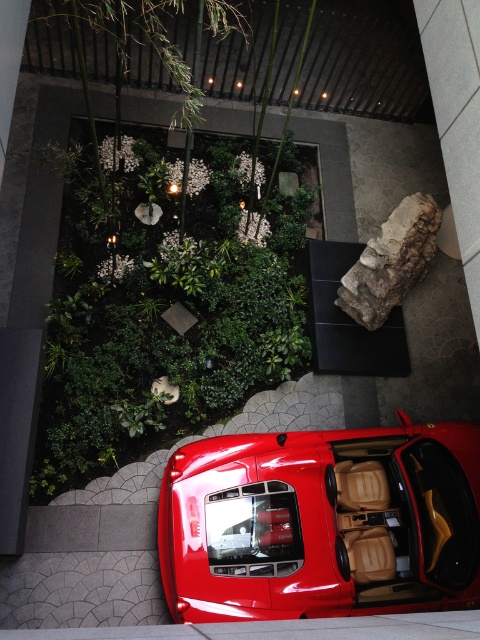
Question: Is green leafy plant at center below glossy red car at center?

Choices:
 (A) no
 (B) yes

Answer: (A)

Question: Is green leafy plant at center bigger than glossy red car at center?

Choices:
 (A) yes
 (B) no

Answer: (A)

Question: Which of the following is the closest to the observer?

Choices:
 (A) green leafy plant at center
 (B) glossy red car at center

Answer: (B)

Question: Is green leafy plant at center above glossy red car at center?

Choices:
 (A) no
 (B) yes

Answer: (B)

Question: Which object is closer to the camera taking this photo?

Choices:
 (A) glossy red car at center
 (B) green leafy plant at center

Answer: (A)

Question: Which point is closer to the camera?

Choices:
 (A) glossy red car at center
 (B) green leafy plant at center

Answer: (A)